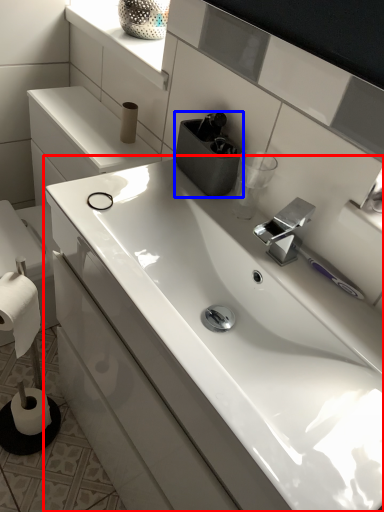
Question: Which object is closer to the camera taking this photo, sink (highlighted by a red box) or appliance (highlighted by a blue box)?

Choices:
 (A) sink
 (B) appliance

Answer: (A)